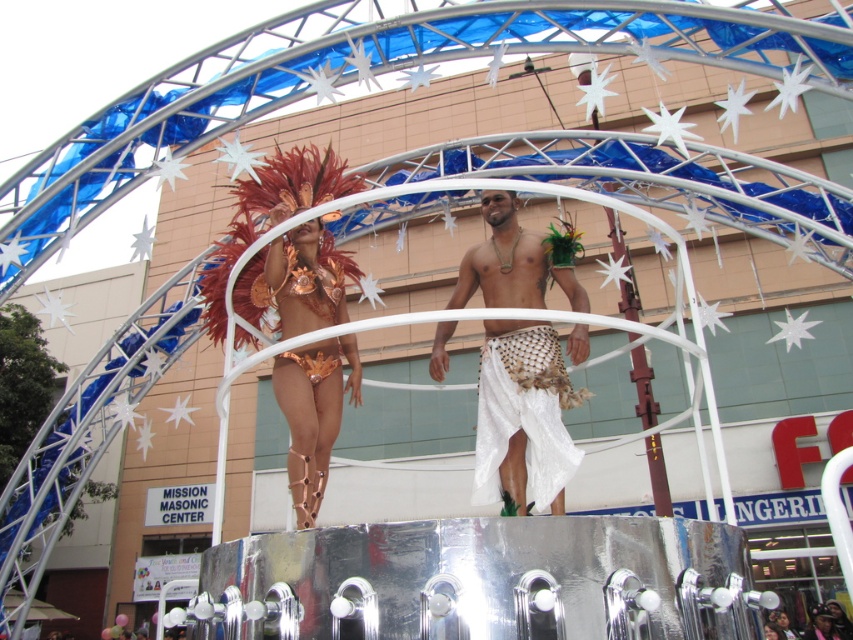
Question: Which object is closer to the camera taking this photo?

Choices:
 (A) metallic gold bikini at center
 (B) white woven skirt at center
 (C) white woven cloth at center
 (D) copper metallic bikini at center

Answer: (B)

Question: Can you confirm if copper metallic bikini at center is positioned to the left of metallic gold bikini at center?

Choices:
 (A) yes
 (B) no

Answer: (A)

Question: Is white woven cloth at center above metallic gold bikini at center?

Choices:
 (A) yes
 (B) no

Answer: (B)

Question: Where is white woven cloth at center located in relation to metallic gold bikini at center in the image?

Choices:
 (A) below
 (B) above

Answer: (A)

Question: Which of the following is the farthest from the observer?

Choices:
 (A) metallic gold bikini at center
 (B) white woven cloth at center
 (C) copper metallic bikini at center

Answer: (A)

Question: Among these points, which one is farthest from the camera?

Choices:
 (A) (302, 307)
 (B) (521, 355)
 (C) (569, 458)

Answer: (A)